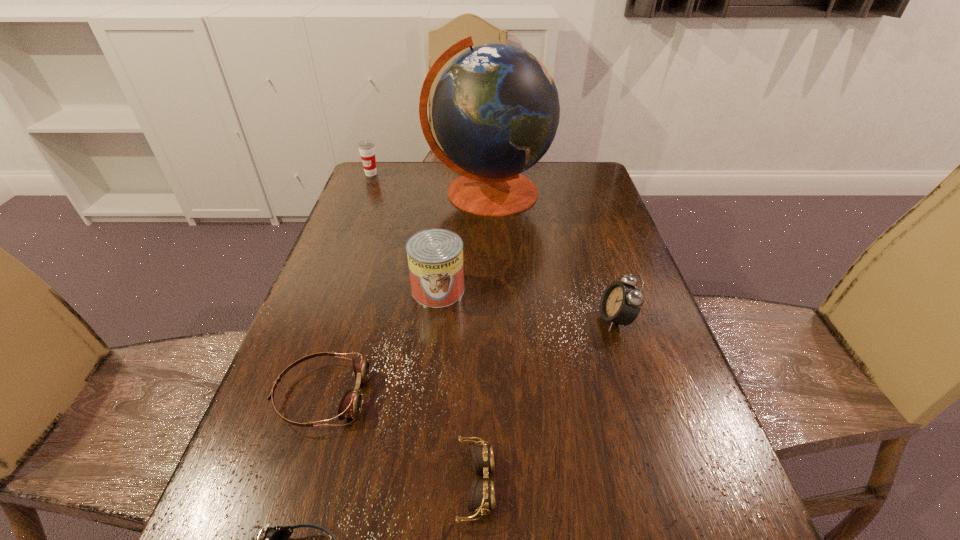
At what (x,y) coordinates should I click in order to perform the action: click on object at the far left corner. Please return your answer as a coordinate pair (x, y). The width and height of the screenshot is (960, 540). Looking at the image, I should click on (366, 148).

In the image, there is a desktop. Identify the location of vacant area at the far edge. (441, 192).

I want to click on blank space at the left edge, so click(314, 288).

Find the location of a particular element. vacant space at the right edge of the desktop is located at coordinates (590, 232).

Where is `free space at the far right corner of the desktop`? free space at the far right corner of the desktop is located at coordinates (572, 194).

The image size is (960, 540). I want to click on vacant space in between the tallest object and the can, so click(464, 241).

Find the location of a particular element. The height and width of the screenshot is (540, 960). empty location between the alarm clock and the farthest goggles is located at coordinates (468, 357).

I want to click on free space between the rightmost object and the can, so 527,305.

Where is `vacant area that lies between the alarm clock and the globe`? vacant area that lies between the alarm clock and the globe is located at coordinates (552, 255).

Identify the location of free space between the fifth farthest object and the globe. (405, 294).